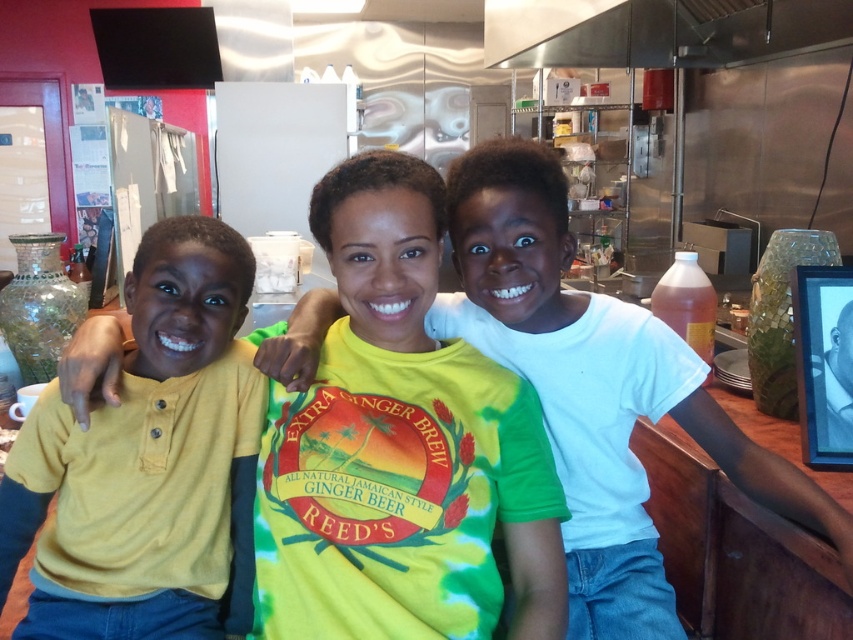
Question: Is yellow cotton shirt at left bigger than stainless steel exhaust hood at upper center?

Choices:
 (A) no
 (B) yes

Answer: (A)

Question: Which object is closer to the camera taking this photo?

Choices:
 (A) stainless steel exhaust hood at upper center
 (B) yellow cotton shirt at center
 (C) white matte shirt at center
 (D) yellow cotton shirt at left

Answer: (B)

Question: Can you confirm if yellow cotton shirt at center is wider than stainless steel exhaust hood at upper center?

Choices:
 (A) no
 (B) yes

Answer: (A)

Question: Considering the real-world distances, which object is closest to the stainless steel exhaust hood at upper center?

Choices:
 (A) yellow cotton shirt at center
 (B) white matte shirt at center
 (C) yellow cotton shirt at left

Answer: (B)

Question: Which point is farther to the camera?

Choices:
 (A) (549, 288)
 (B) (183, 564)

Answer: (A)

Question: Can you confirm if yellow cotton shirt at center is bigger than stainless steel exhaust hood at upper center?

Choices:
 (A) yes
 (B) no

Answer: (B)